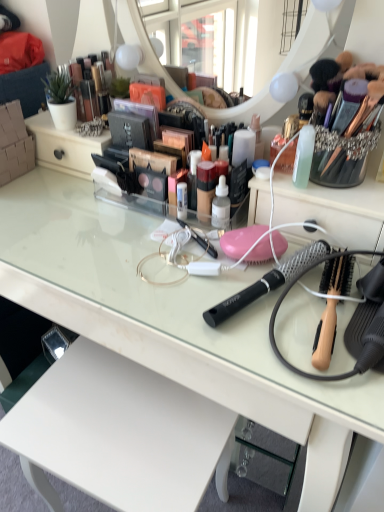
Question: Does wooden-handled hairbrush at right, the 2th brush in the left-to-right sequence, have a lesser height compared to metallic gold makeup at upper left?

Choices:
 (A) no
 (B) yes

Answer: (B)

Question: Considering the relative sizes of wooden-handled hairbrush at right, the 2th brush in the left-to-right sequence, and metallic gold makeup at upper left in the image provided, is wooden-handled hairbrush at right, the 2th brush in the left-to-right sequence, smaller than metallic gold makeup at upper left?

Choices:
 (A) yes
 (B) no

Answer: (A)

Question: Can you confirm if wooden-handled hairbrush at right, the 2th brush in the left-to-right sequence, is taller than metallic gold makeup at upper left?

Choices:
 (A) no
 (B) yes

Answer: (A)

Question: From the image's perspective, is wooden-handled hairbrush at right, the first brush when ordered from right to left, under metallic gold makeup at upper left?

Choices:
 (A) yes
 (B) no

Answer: (A)

Question: Can you confirm if wooden-handled hairbrush at right, the first brush when ordered from right to left, is bigger than metallic gold makeup at upper left?

Choices:
 (A) yes
 (B) no

Answer: (B)

Question: Is point (92, 111) positioned closer to the camera than point (16, 183)?

Choices:
 (A) closer
 (B) farther

Answer: (B)

Question: Considering the positions of metallic gold makeup at upper left and clear glass desk at center in the image, is metallic gold makeup at upper left wider or thinner than clear glass desk at center?

Choices:
 (A) thin
 (B) wide

Answer: (A)

Question: Is metallic gold makeup at upper left bigger or smaller than clear glass desk at center?

Choices:
 (A) big
 (B) small

Answer: (B)

Question: Is metallic gold makeup at upper left taller or shorter than clear glass desk at center?

Choices:
 (A) tall
 (B) short

Answer: (B)

Question: Considering the positions of black mesh hairbrush at center, which appears as the second brush when viewed from the right, and metallic gold makeup at upper left in the image, is black mesh hairbrush at center, which appears as the second brush when viewed from the right, taller or shorter than metallic gold makeup at upper left?

Choices:
 (A) short
 (B) tall

Answer: (A)

Question: Looking at their shapes, would you say black mesh hairbrush at center, which appears as the second brush when viewed from the right, is wider or thinner than metallic gold makeup at upper left?

Choices:
 (A) thin
 (B) wide

Answer: (B)

Question: Is black mesh hairbrush at center, which appears as the second brush when viewed from the right, in front of or behind metallic gold makeup at upper left in the image?

Choices:
 (A) front
 (B) behind

Answer: (A)

Question: Is point (223, 313) closer or farther from the camera than point (94, 106)?

Choices:
 (A) closer
 (B) farther

Answer: (A)

Question: In terms of size, does clear glass desk at center appear bigger or smaller than metallic gold makeup at upper left?

Choices:
 (A) small
 (B) big

Answer: (B)

Question: Looking at their shapes, would you say clear glass desk at center is wider or thinner than metallic gold makeup at upper left?

Choices:
 (A) thin
 (B) wide

Answer: (B)